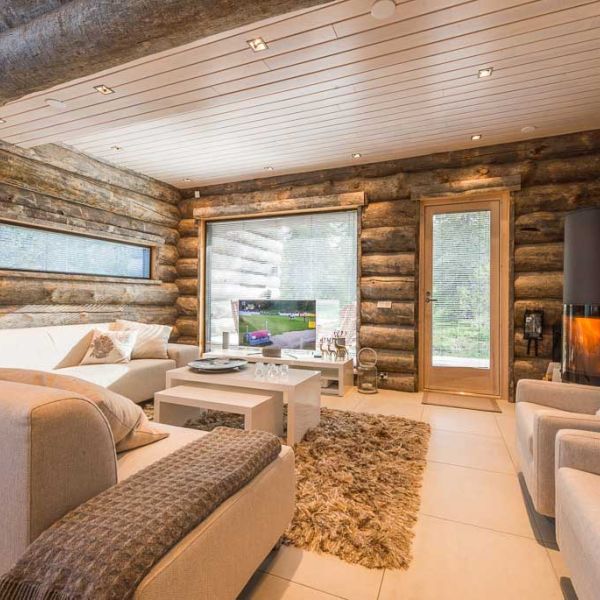
You are a GUI agent. You are given a task and a screenshot of the screen. Output one action in this format:
    pyautogui.click(x=<x>, y=<y>)
    Task: Click on the fire place
    The image size is (600, 600).
    Given the screenshot: What is the action you would take?
    pyautogui.click(x=583, y=335)